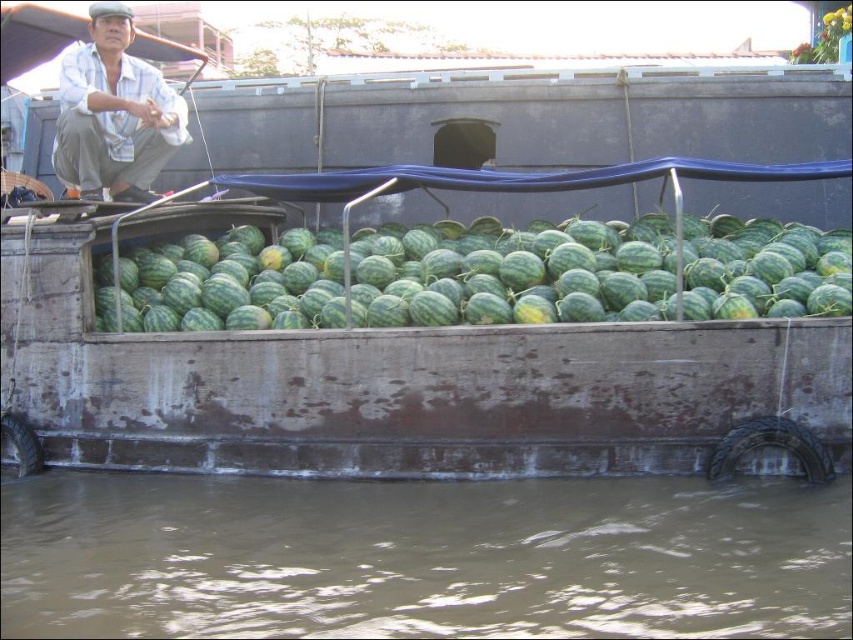
Question: Which object appears closest to the camera in this image?

Choices:
 (A) white cotton shirt at upper left
 (B) brown murky water at lower center
 (C) green matte watermelon at center

Answer: (B)

Question: In this image, where is brown murky water at lower center located relative to green matte watermelon at center?

Choices:
 (A) left
 (B) right

Answer: (A)

Question: Can you confirm if brown murky water at lower center is bigger than green matte watermelon at center?

Choices:
 (A) yes
 (B) no

Answer: (B)

Question: Among these points, which one is farthest from the camera?

Choices:
 (A) (660, 218)
 (B) (90, 99)

Answer: (A)

Question: Can you confirm if green matte watermelon at center is smaller than white cotton shirt at upper left?

Choices:
 (A) no
 (B) yes

Answer: (B)

Question: Considering the real-world distances, which object is farthest from the white cotton shirt at upper left?

Choices:
 (A) green matte watermelon at center
 (B) brown murky water at lower center

Answer: (B)